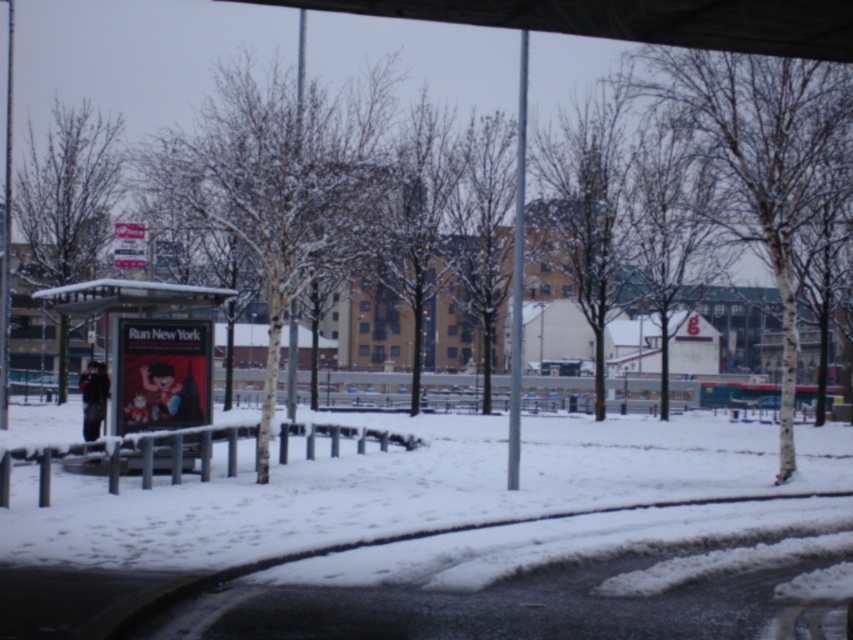
You are a pedestrian trying to reach the bus stop. You are currently standing on the white powdery snow at lower center. Which direction should you walk to reach the white plastic bus stop at left?

Since the white powdery snow at lower center is to the right of the white plastic bus stop at left, you should walk to the left to reach the bus stop.